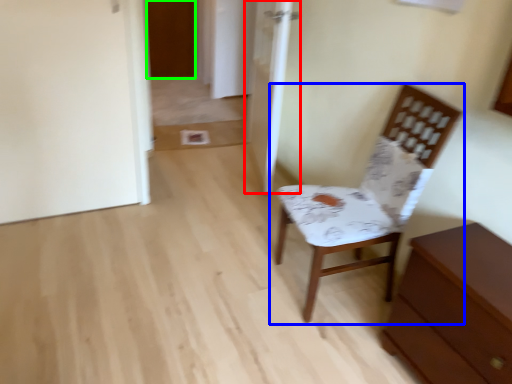
Question: Which is nearer to the door (highlighted by a red box)? chair (highlighted by a blue box) or door (highlighted by a green box).

Choices:
 (A) chair
 (B) door

Answer: (A)